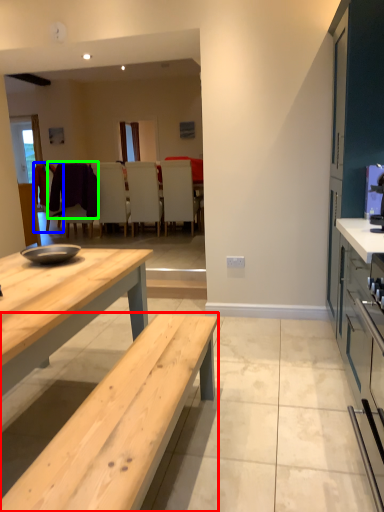
Question: Which is farther away from table (highlighted by a red box)? chair (highlighted by a blue box) or laundry (highlighted by a green box)?

Choices:
 (A) chair
 (B) laundry

Answer: (B)